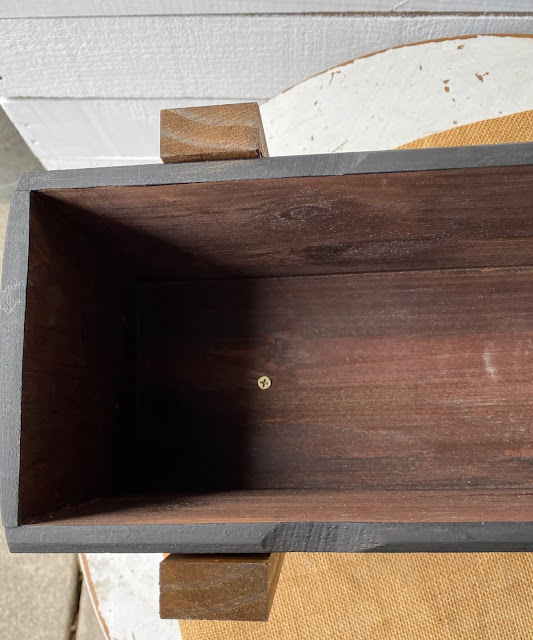
Where is `wooden box`? The image size is (533, 640). wooden box is located at coordinates (505, 161), (130, 200), (15, 289), (64, 372), (230, 454), (298, 520), (366, 537), (226, 544).